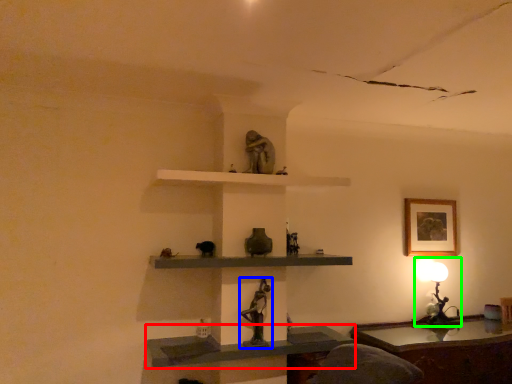
Question: Estimate the real-world distances between objects in this image. Which object is farther from shelf (highlighted by a red box), sculpture (highlighted by a blue box) or table lamp (highlighted by a green box)?

Choices:
 (A) sculpture
 (B) table lamp

Answer: (B)